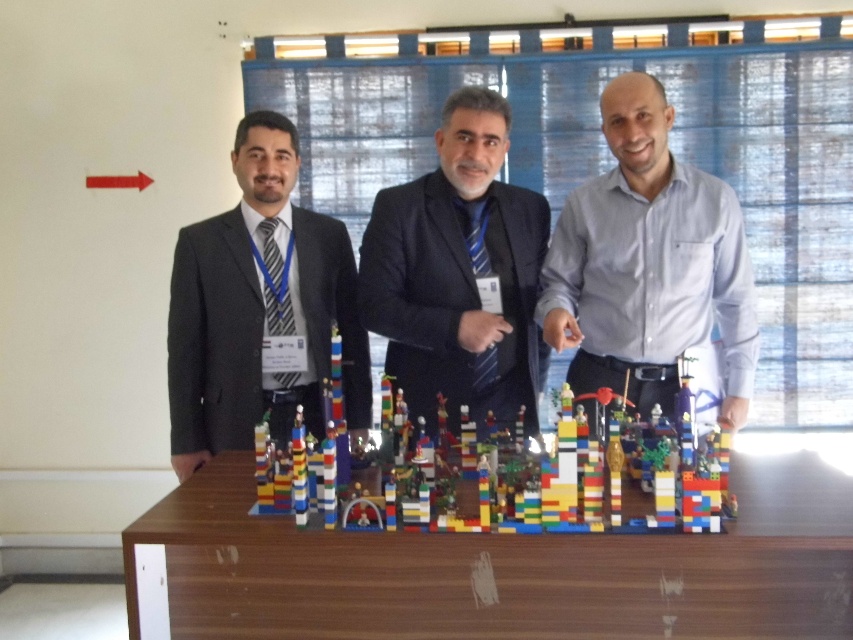
You are standing in front of the table with LEGO structures and need to determine which of the two points, point (601, 248) or point (440, 416), is closer to you. Based on the scene description, which point is nearer?

Point (601, 248) is further to the viewer than point (440, 416), so point (440, 416) is closer to you.